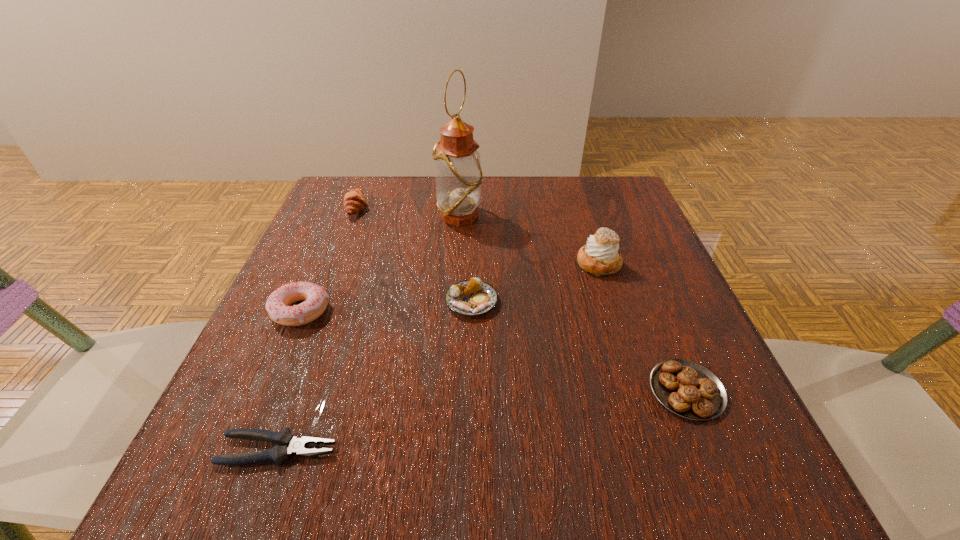
You are a GUI agent. You are given a task and a screenshot of the screen. Output one action in this format:
    pyautogui.click(x=<x>, y=<y>)
    Task: Click on the free space between the oil lamp and the sixth shortest object
    
    Given the screenshot: What is the action you would take?
    pyautogui.click(x=529, y=240)

At what (x,y) coordinates should I click in order to perform the action: click on vacant point located between the nearest pastry and the third pastry from right to left. Please return your answer as a coordinate pair (x, y). Looking at the image, I should click on (579, 346).

Image resolution: width=960 pixels, height=540 pixels. Identify the location of blank region between the third shortest pastry and the doughnut. (328, 260).

Locate which object is the fourth closest to the nearest pastry. Please provide its 2D coordinates. Your answer should be formatted as a tuple, i.e. [(x, y)], where the tuple contains the x and y coordinates of a point satisfying the conditions above.

[(289, 445)]

Identify which object is the third closest to the second farthest pastry. Please provide its 2D coordinates. Your answer should be formatted as a tuple, i.e. [(x, y)], where the tuple contains the x and y coordinates of a point satisfying the conditions above.

[(458, 171)]

Where is `pastry that stands as the second closest to the tallest pastry`? pastry that stands as the second closest to the tallest pastry is located at coordinates (686, 388).

Point out which pastry is positioned as the third nearest to the oil lamp. Please provide its 2D coordinates. Your answer should be formatted as a tuple, i.e. [(x, y)], where the tuple contains the x and y coordinates of a point satisfying the conditions above.

[(600, 256)]

The image size is (960, 540). Find the location of `free point that satisfies the following two spatial constraints: 1. on the front-facing side of the leftmost pastry; 2. on the back side of the tallest object`. free point that satisfies the following two spatial constraints: 1. on the front-facing side of the leftmost pastry; 2. on the back side of the tallest object is located at coordinates (353, 217).

The image size is (960, 540). Find the location of `free point that satisfies the following two spatial constraints: 1. on the front-facing side of the farthest pastry; 2. on the back side of the second nearest pastry`. free point that satisfies the following two spatial constraints: 1. on the front-facing side of the farthest pastry; 2. on the back side of the second nearest pastry is located at coordinates (320, 302).

Find the location of a particular element. The image size is (960, 540). free location that satisfies the following two spatial constraints: 1. on the back side of the sixth shortest object; 2. on the front-facing side of the third shortest pastry is located at coordinates (581, 208).